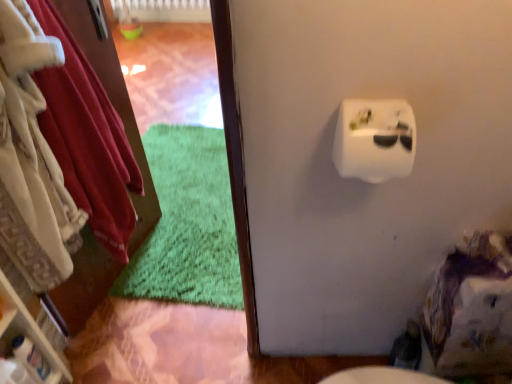
Question: Does velvety white robe at left have a greater height compared to white plastic toilet paper at upper right?

Choices:
 (A) no
 (B) yes

Answer: (B)

Question: Could you tell me if velvety white robe at left is facing white plastic toilet paper at upper right?

Choices:
 (A) yes
 (B) no

Answer: (B)

Question: Are velvety white robe at left and white plastic toilet paper at upper right beside each other?

Choices:
 (A) yes
 (B) no

Answer: (B)

Question: Is velvety white robe at left thinner than white plastic toilet paper at upper right?

Choices:
 (A) no
 (B) yes

Answer: (A)

Question: Does velvety white robe at left have a smaller size compared to white plastic toilet paper at upper right?

Choices:
 (A) no
 (B) yes

Answer: (A)

Question: From the image's perspective, does velvety white robe at left appear higher than white plastic toilet paper at upper right?

Choices:
 (A) no
 (B) yes

Answer: (B)

Question: From a real-world perspective, is white plastic toilet paper at upper right under velvety white robe at left?

Choices:
 (A) no
 (B) yes

Answer: (A)

Question: Is white plastic toilet paper at upper right completely or partially outside of velvety white robe at left?

Choices:
 (A) no
 (B) yes

Answer: (B)

Question: Could you tell me if white plastic toilet paper at upper right is facing velvety white robe at left?

Choices:
 (A) no
 (B) yes

Answer: (A)

Question: Can you confirm if white plastic toilet paper at upper right is wider than velvety white robe at left?

Choices:
 (A) yes
 (B) no

Answer: (B)

Question: Are white plastic toilet paper at upper right and velvety white robe at left far apart?

Choices:
 (A) yes
 (B) no

Answer: (B)

Question: Can you confirm if white plastic toilet paper at upper right is thinner than velvety white robe at left?

Choices:
 (A) no
 (B) yes

Answer: (B)

Question: Can you confirm if velvety white robe at left is smaller than white plastic shelf at left?

Choices:
 (A) yes
 (B) no

Answer: (B)